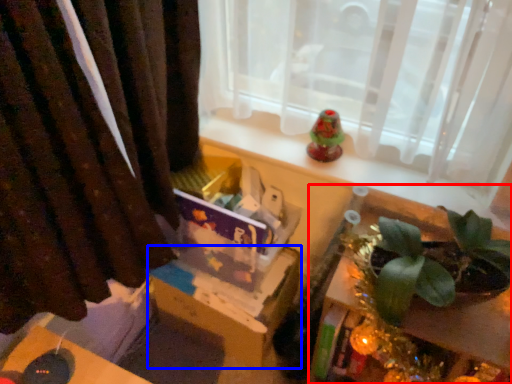
Question: Among these objects, which one is farthest to the camera, table (highlighted by a red box) or cardboard box (highlighted by a blue box)?

Choices:
 (A) table
 (B) cardboard box

Answer: (B)